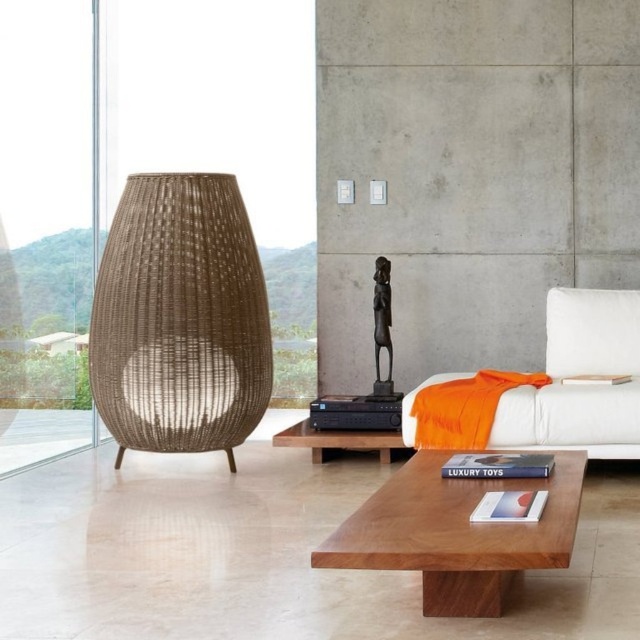
You are sitting on the white fabric couch at right and want to place the white fabric pillow at right on a shelf that requires items to be under 1 meter in height. Can the pillow fit based on their heights?

The white fabric couch at right is taller than the white fabric pillow at right. Since the pillow is shorter than the couch, it should fit under the 1 meter height requirement for the shelf.